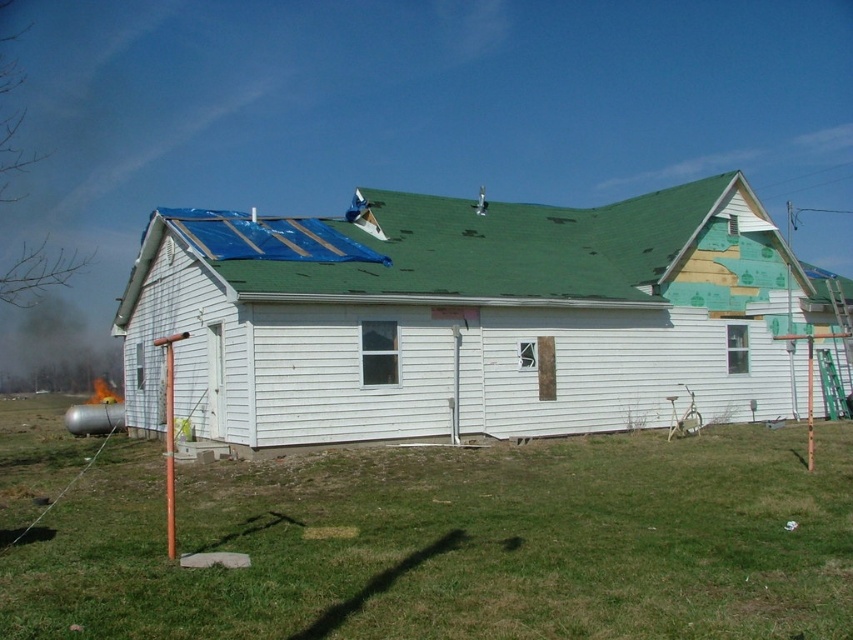
Looking at the construction site, which area takes up more space between the green grass at lower center and the green shingles at upper center?

The green shingles at upper center occupy more space than the green grass at lower center.

You are a delivery person approaching the residential building under renovation. You see the green grass at lower center and the green shingles at upper center. Which of these two objects is located to the left when viewed from your perspective?

The green grass at lower center is positioned on the left side of green shingles at upper center, so the green grass at lower center is located to the left when viewed from your perspective.